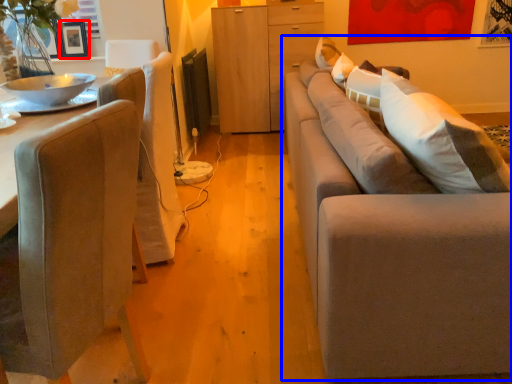
Question: Which of the following is the farthest to the observer, picture frame (highlighted by a red box) or studio couch (highlighted by a blue box)?

Choices:
 (A) picture frame
 (B) studio couch

Answer: (A)